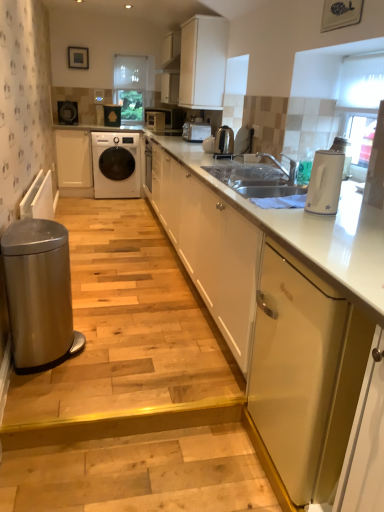
Locate an element on the screen. This screenshot has height=512, width=384. vacant area on top of natural wood stairs at lower left, positioned as the second stair in top-to-bottom order (from a real-world perspective) is located at coordinates (124, 466).